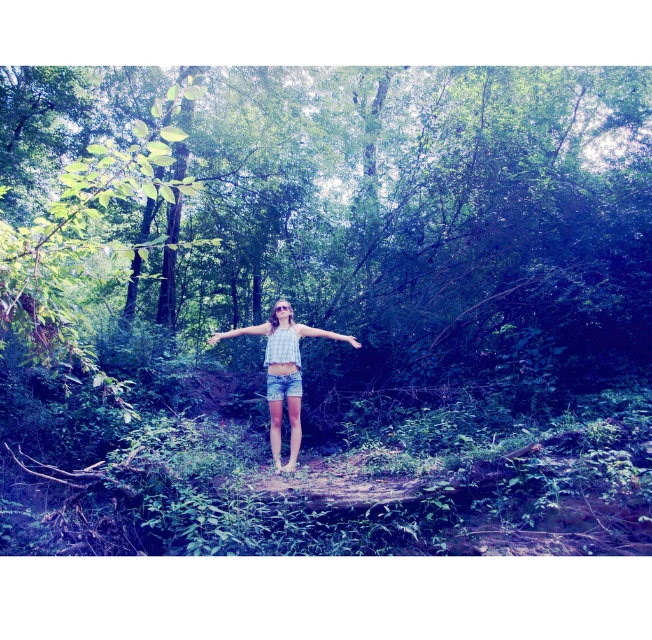
Is green leafy tree at center smaller than blue fabric hand at center?

No, green leafy tree at center is not smaller than blue fabric hand at center.

This screenshot has width=652, height=640. Find the location of `green leafy tree at center`. green leafy tree at center is located at coordinates (329, 209).

Does point (349, 305) lie behind point (355, 342)?

That is True.

You are a GUI agent. You are given a task and a screenshot of the screen. Output one action in this format:
    pyautogui.click(x=<x>, y=<y>)
    Task: Click on the green leafy tree at center
    The height and width of the screenshot is (640, 652).
    Given the screenshot: What is the action you would take?
    pyautogui.click(x=329, y=209)

Does green leafy tree at center appear on the left side of matte white arm at center?

No, green leafy tree at center is not to the left of matte white arm at center.

Between green leafy tree at center and matte white arm at center, which one is positioned lower?

matte white arm at center is lower down.

Does point (53, 305) come closer to viewer compared to point (226, 332)?

Yes, point (53, 305) is in front of point (226, 332).

The width and height of the screenshot is (652, 640). In order to click on green leafy tree at center in this screenshot , I will do pyautogui.click(x=329, y=209).

Can you confirm if green leafy tree at center is positioned to the left of checkered fabric blouse at center?

Yes, green leafy tree at center is to the left of checkered fabric blouse at center.

Which is more to the right, green leafy tree at center or checkered fabric blouse at center?

checkered fabric blouse at center

Does point (8, 326) come behind point (274, 460)?

That is False.

The height and width of the screenshot is (640, 652). Find the location of `green leafy tree at center`. green leafy tree at center is located at coordinates [329, 209].